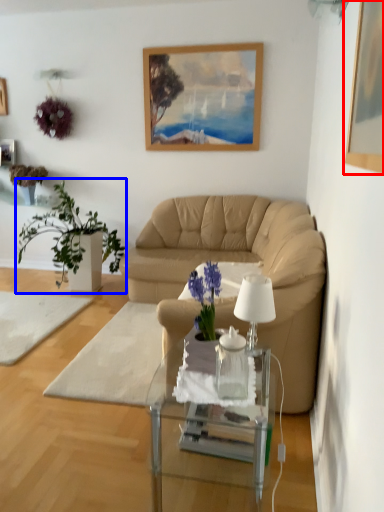
Question: Which object is closer to the camera taking this photo, picture frame (highlighted by a red box) or houseplant (highlighted by a blue box)?

Choices:
 (A) picture frame
 (B) houseplant

Answer: (A)